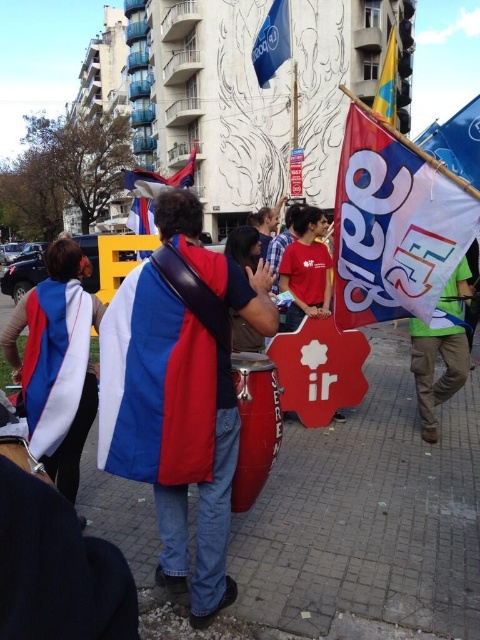
You are a photographer standing at the center of the street. You want to capture both the green fabric flag at right and the blue and white fabric flag at center in a single wide shot. Given that your camera has a maximum focal length allowing you to capture objects up to 5 meters apart in the frame, will you be able to include both flags in your photo?

The distance between the green fabric flag at right and the blue and white fabric flag at center is 4.85 meters, which is within the camera maximum focal length of 5 meters. Therefore, you can include both flags in the photo.

You are a photographer trying to capture the red and blue fabric at center in your shot. Based on the scene description, where should you position your camera to ensure the fabric is centered in the frame?

The red and blue fabric at center is located at point (x=180, y=392), so you should position your camera to aim directly at those coordinates to center the fabric in your frame.